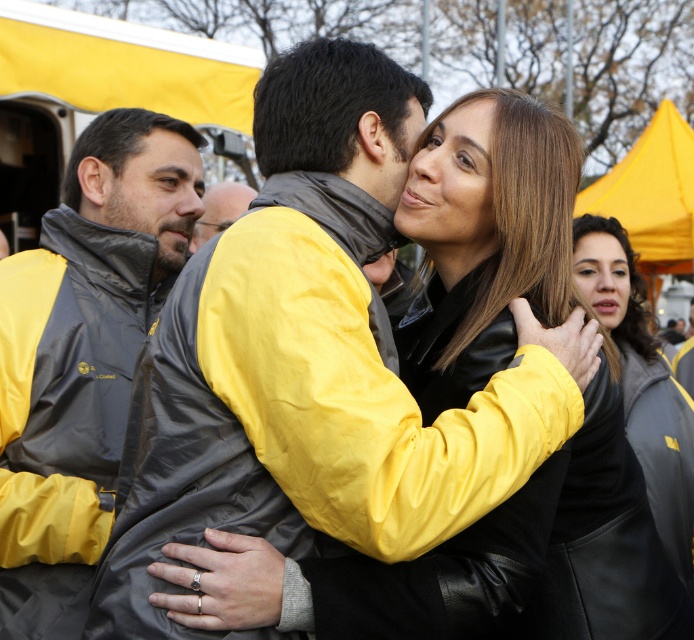
Question: Which point appears farthest from the camera in this image?

Choices:
 (A) (583, 280)
 (B) (110, 461)
 (C) (212, 228)

Answer: (C)

Question: Considering the real-world distances, which object is farthest from the matte black jacket at left?

Choices:
 (A) yellow matte jacket at center
 (B) black leather jacket at center

Answer: (B)

Question: Is black leather jacket at center closer to camera compared to yellow matte jacket at center?

Choices:
 (A) yes
 (B) no

Answer: (A)

Question: Can you confirm if black leather jacket at center is positioned above yellow matte jacket at center?

Choices:
 (A) no
 (B) yes

Answer: (A)

Question: Is black leather jacket at center smaller than yellow matte jacket at center?

Choices:
 (A) yes
 (B) no

Answer: (B)

Question: Which of the following is the farthest from the observer?

Choices:
 (A) (627, 428)
 (B) (167, 276)

Answer: (A)